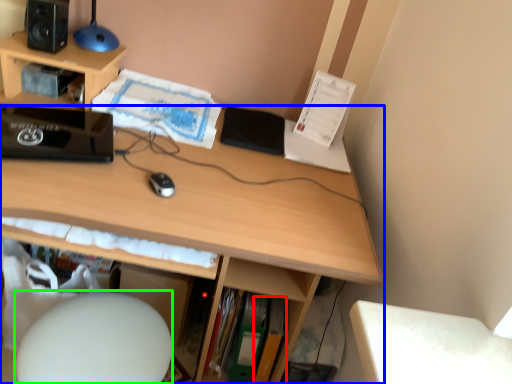
Question: Estimate the real-world distances between objects in this image. Which object is closer to paperback book (highlighted by a red box), desk (highlighted by a blue box) or computer chair (highlighted by a green box)?

Choices:
 (A) desk
 (B) computer chair

Answer: (A)